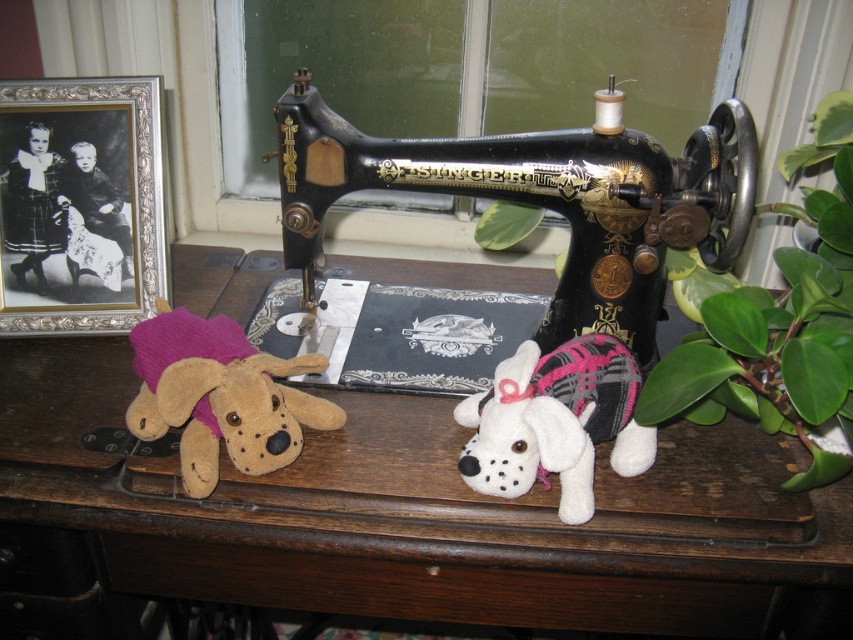
Question: Is silver/glass picture frame at upper left thinner than white plush dog at center?

Choices:
 (A) yes
 (B) no

Answer: (A)

Question: Which of the following is the farthest from the observer?

Choices:
 (A) black polished wood sewing machine at center
 (B) fuzzy brown stuffed dog at left
 (C) white plush dog at center

Answer: (A)

Question: Is silver/glass picture frame at upper left above green leafy plant at right?

Choices:
 (A) yes
 (B) no

Answer: (A)

Question: Which object is closer to the camera taking this photo?

Choices:
 (A) fuzzy brown stuffed dog at left
 (B) black polished wood sewing machine at center
 (C) green leafy plant at right

Answer: (C)

Question: Is silver/glass picture frame at upper left thinner than white plush dog at center?

Choices:
 (A) no
 (B) yes

Answer: (B)

Question: Which of these objects is positioned farthest from the fuzzy brown stuffed dog at left?

Choices:
 (A) silver/glass picture frame at upper left
 (B) brown wooden table at center
 (C) white plush dog at center
 (D) black polished wood sewing machine at center

Answer: (D)